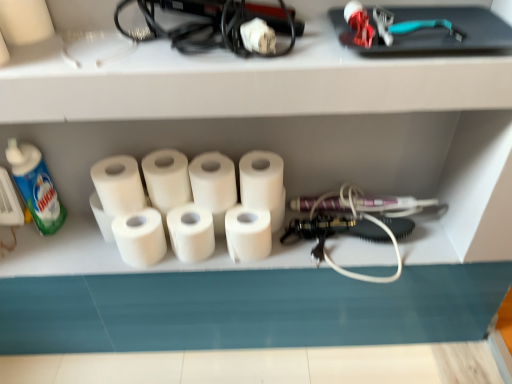
At what (x,y) coordinates should I click in order to perform the action: click on vacant area that lies in front of green matte bottle at left. Please return your answer as a coordinate pair (x, y). The width and height of the screenshot is (512, 384). Looking at the image, I should click on (41, 253).